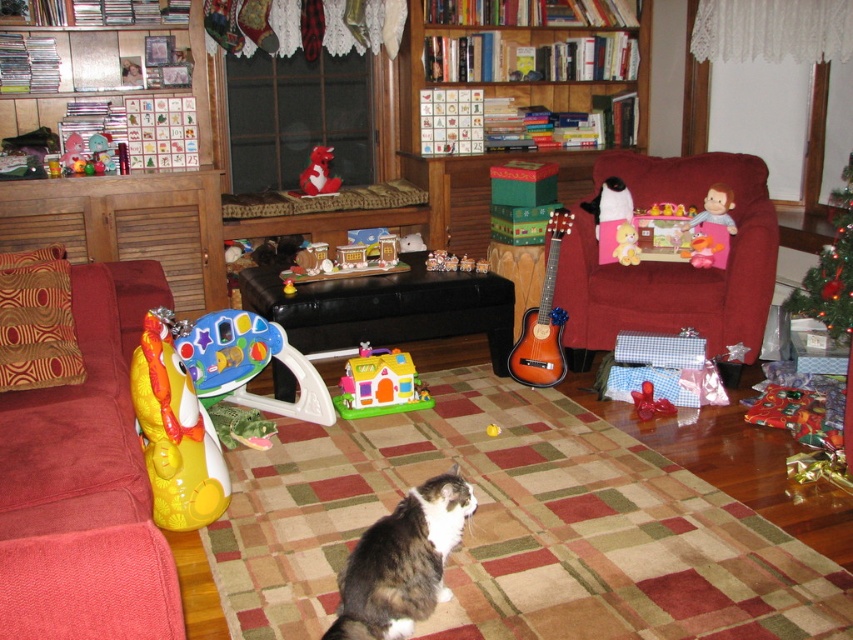
You are a child who wants to place the yellow rubber duck at left on top of the green shiny christmas tree at upper right. Can you do this without the duck falling off?

The yellow rubber duck at left is shorter than the green shiny christmas tree at upper right, so it might be possible to place it there. However, the stability depends on the tree base and the duck placement. Since the duck is smaller, it might not tip over easily, but ensure it is placed securely.

You are a guest entering the living room and want to sit down. The velvet red couch at left and the gray fluffy cat at center are both in your line of sight. Which object is higher from the floor?

The velvet red couch at left is located above gray fluffy cat at center, so the velvet red couch at left is higher from the floor.

You are a guest in this living room and want to place a small decorative item between the gray fluffy cat at center and the plastic house at center. Which object should you place it closer to to ensure it doesn

The gray fluffy cat at center is bigger than the plastic house at center, so placing the item closer to the smaller plastic house at center would maintain balance between the two objects.